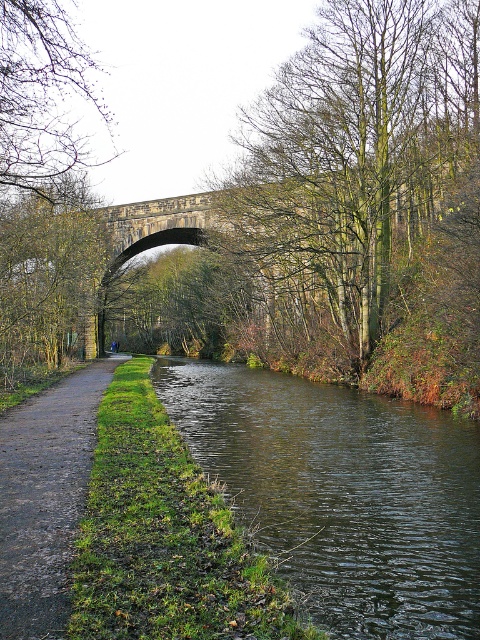
Question: Based on their relative distances, which object is nearer to the green leafy tree at center?

Choices:
 (A) bare branches at upper left
 (B) dull brown dirt path at lower left

Answer: (A)

Question: Can you confirm if dark green water at lower center is bigger than bare branches at upper left?

Choices:
 (A) no
 (B) yes

Answer: (A)

Question: Which object is farther from the camera taking this photo?

Choices:
 (A) green leafy tree at center
 (B) dull brown dirt path at lower left
 (C) dark green water at lower center
 (D) bare branches at upper left

Answer: (A)

Question: Which of these objects is positioned closest to the dull brown dirt path at lower left?

Choices:
 (A) bare branches at upper left
 (B) dark green water at lower center
 (C) green leafy tree at center

Answer: (B)

Question: Is dull brown dirt path at lower left further to camera compared to bare branches at upper left?

Choices:
 (A) yes
 (B) no

Answer: (B)

Question: Does dark green water at lower center have a larger size compared to bare branches at upper left?

Choices:
 (A) no
 (B) yes

Answer: (A)